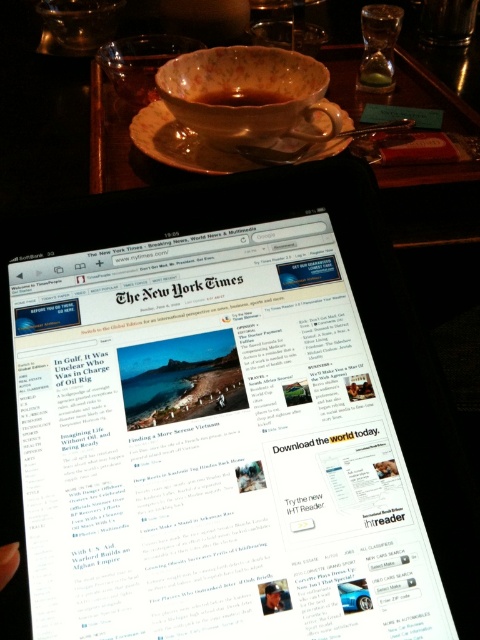
Does point (197, 147) come behind point (212, 99)?

No, (197, 147) is closer to viewer.

Is point (187, 164) in front of point (207, 93)?

That is True.

This screenshot has width=480, height=640. In order to click on matte ceramic saucer at upper center in this screenshot , I will do `click(181, 145)`.